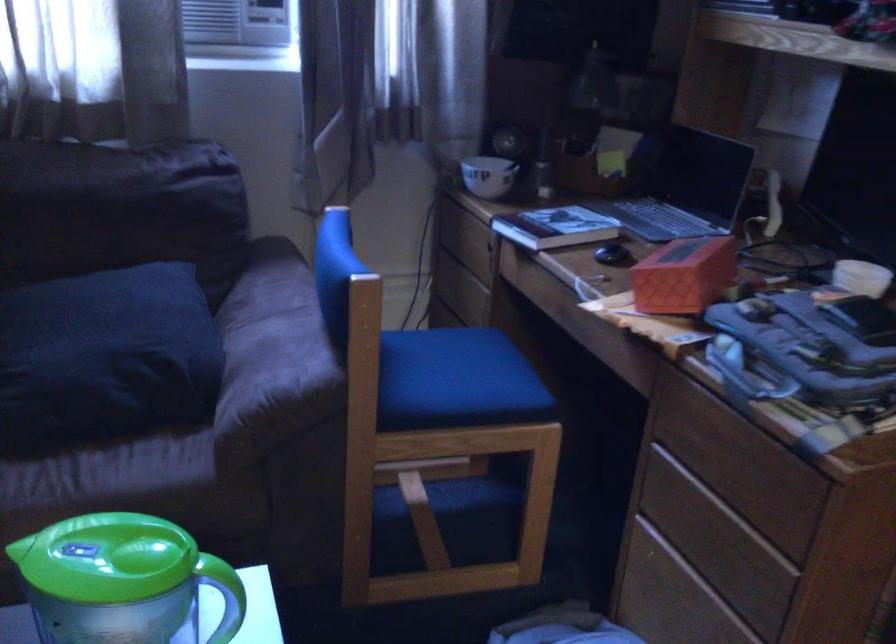
This screenshot has height=644, width=896. What are the coordinates of `blue chair sitting surface` in the screenshot? It's located at (455, 381).